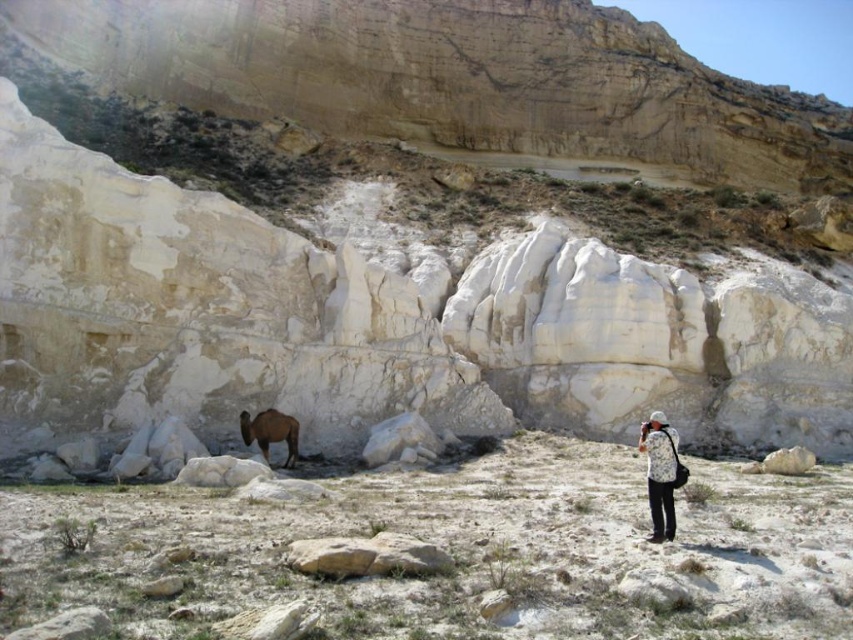
Which is behind, point (851, 637) or point (271, 436)?

Point (271, 436)

Which is more to the left, brown dirt at center or brown fuzzy camel at lower left?

Positioned to the left is brown fuzzy camel at lower left.

The image size is (853, 640). What are the coordinates of `brown dirt at center` in the screenshot? It's located at (457, 550).

Between floral-patterned fabric at lower right and brown fuzzy camel at lower left, which one appears on the right side from the viewer's perspective?

floral-patterned fabric at lower right is more to the right.

Describe the element at coordinates (659, 474) in the screenshot. The image size is (853, 640). I see `floral-patterned fabric at lower right` at that location.

Which is in front, point (654, 426) or point (276, 420)?

Point (654, 426) is in front.

Find the location of a particular element. The height and width of the screenshot is (640, 853). floral-patterned fabric at lower right is located at coordinates (659, 474).

Is brown dirt at center taller than floral-patterned fabric at lower right?

Incorrect, brown dirt at center's height is not larger of floral-patterned fabric at lower right's.

Which is in front, point (688, 541) or point (659, 515)?

Point (688, 541) is more forward.

Does point (209, 502) lie behind point (659, 497)?

Yes, point (209, 502) is behind point (659, 497).

Image resolution: width=853 pixels, height=640 pixels. Find the location of `brown dirt at center`. brown dirt at center is located at coordinates (457, 550).